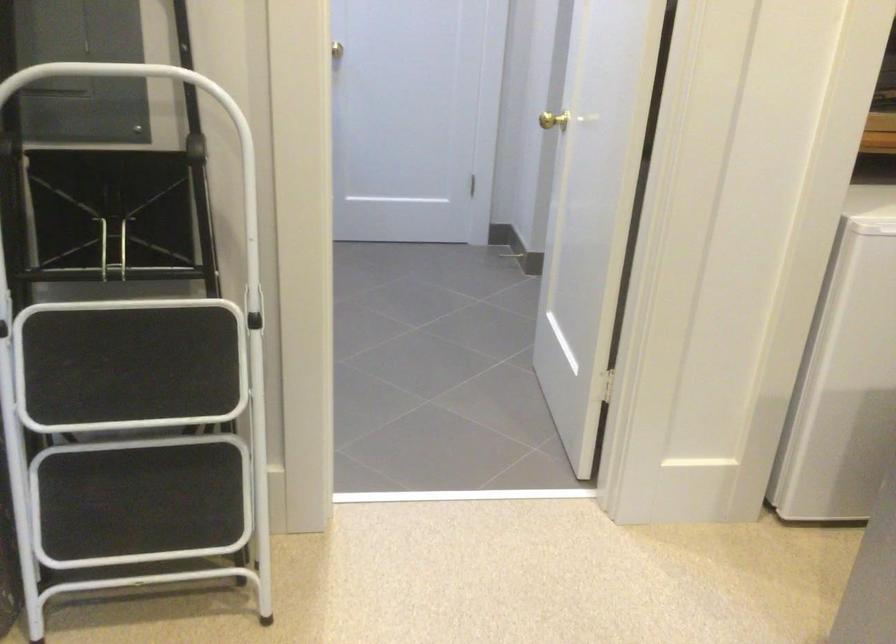
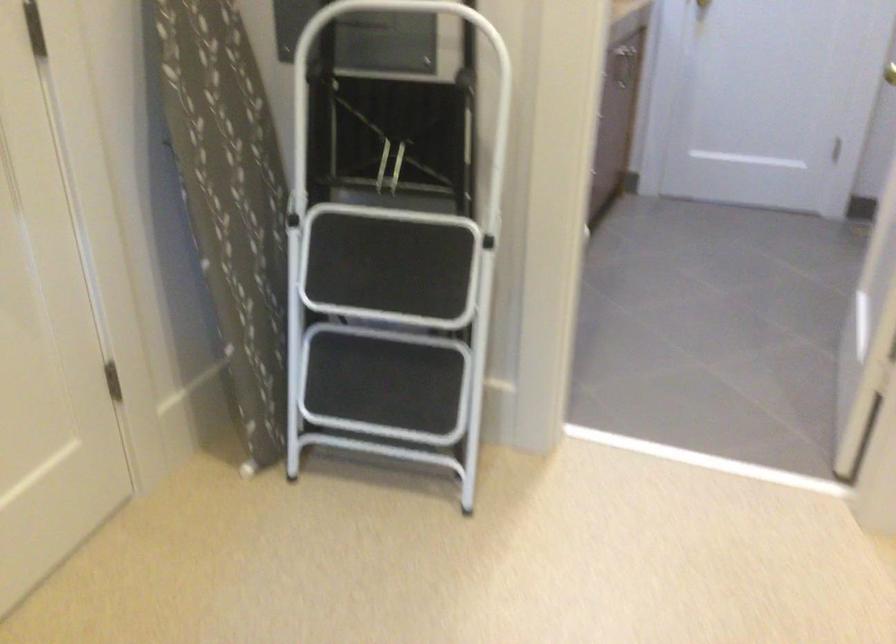
The point at (74, 80) is marked in the first image. Where is the corresponding point in the second image?

(378, 13)